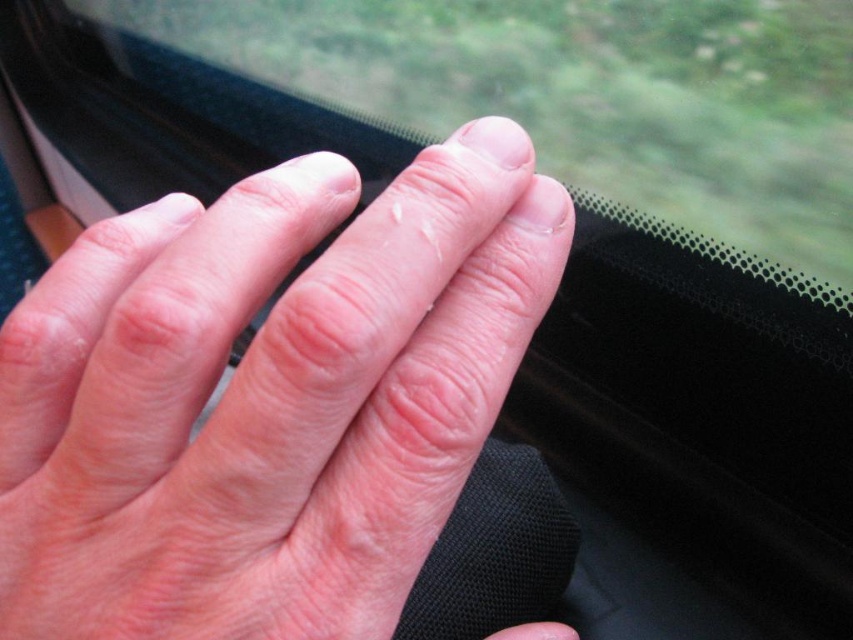
Based on the photo, you are a passenger on a train and you notice your hand resting on the window. Based on the scene, which object is positioned to the left of the other between the pale skin at center and the transparent plastic train window at center?

The transparent plastic train window at center is positioned to the left of the pale skin at center because the pale skin at center is to the right of the transparent plastic train window at center.

You are a passenger on a train and you notice your hand pressed against the transparent plastic train window at center. Your pale skin at center is visible through the window. Which part is shorter in height?

The pale skin at center has a lesser height compared to the transparent plastic train window at center, so the pale skin at center is shorter in height.

From the picture: What are the coordinates of the pale skin at center in the image?

The coordinates of the pale skin at center are at point (x=265, y=396).